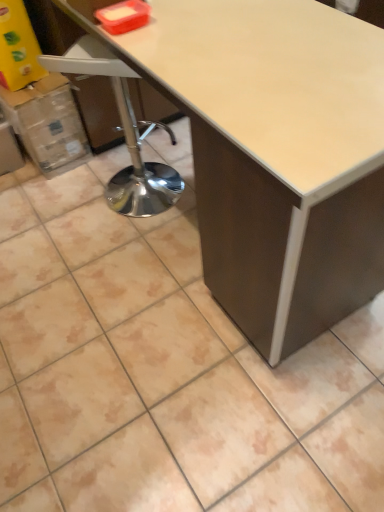
Where is `vacant space situated on the left part of matte white table at center`? The height and width of the screenshot is (512, 384). vacant space situated on the left part of matte white table at center is located at coordinates (79, 264).